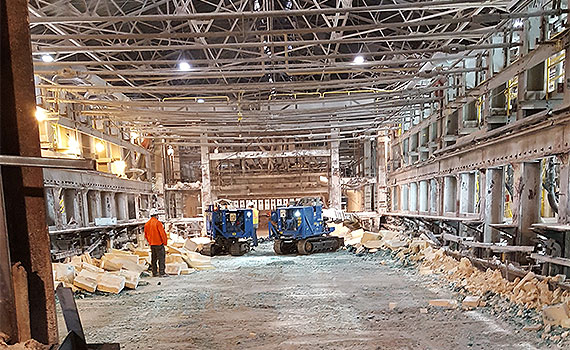
This screenshot has height=350, width=570. I want to click on lights, so 184,64, 46,57, 36,108, 70,149, 97,144, 117,166, 361,61.